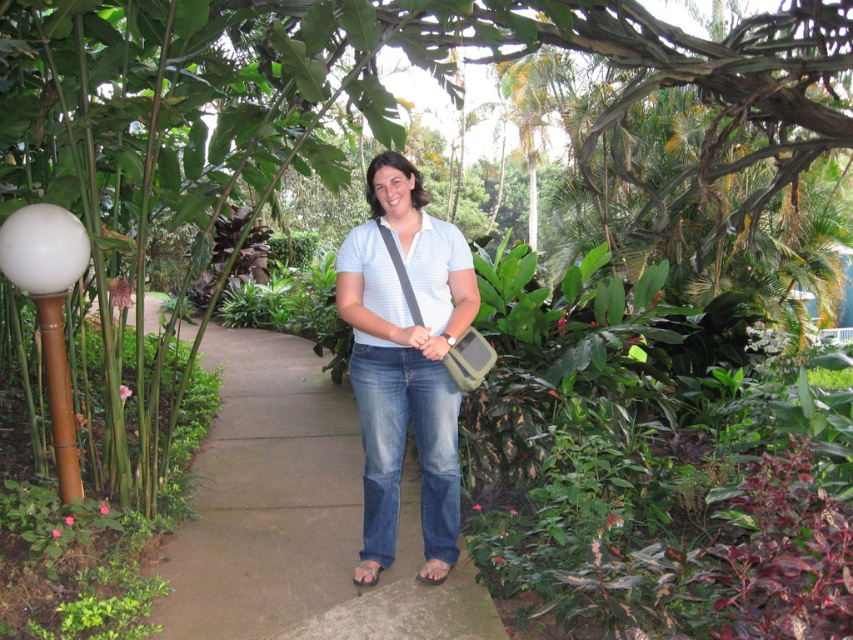
Is gray concrete pavement at center closer to camera compared to white striped shirt at center?

No, it is behind white striped shirt at center.

Is point (213, 445) behind point (451, 292)?

Yes, it is.

Which is behind, point (407, 636) or point (425, 504)?

Positioned behind is point (425, 504).

Where is `gray concrete pavement at center`? gray concrete pavement at center is located at coordinates (296, 516).

Between gray concrete pavement at center and white glossy ball at left, which one has more height?

white glossy ball at left is taller.

Is gray concrete pavement at center in front of white glossy ball at left?

No, it is not.

Is point (161, 563) closer to camera compared to point (64, 492)?

Yes, point (161, 563) is in front of point (64, 492).

Where is `gray concrete pavement at center`? The width and height of the screenshot is (853, 640). gray concrete pavement at center is located at coordinates (296, 516).

Between point (408, 193) and point (41, 296), which one is positioned behind?

Point (41, 296)

Identify the location of white striped shirt at center. This screenshot has height=640, width=853. (405, 362).